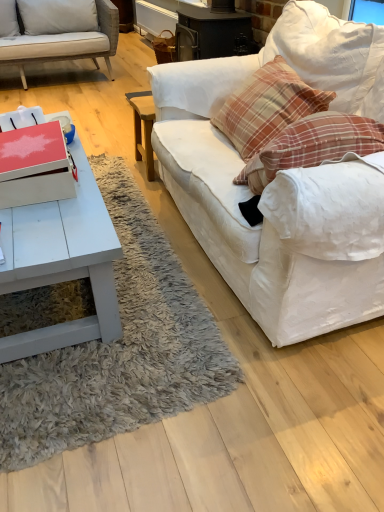
Question: Is white fabric couch at right wider or thinner than white matte coffee table at lower left?

Choices:
 (A) wide
 (B) thin

Answer: (B)

Question: Is white fabric couch at right bigger or smaller than white matte coffee table at lower left?

Choices:
 (A) small
 (B) big

Answer: (B)

Question: Based on their relative distances, which object is nearer to the plaid fabric pillow at upper right?

Choices:
 (A) white fabric couch at right
 (B) white matte coffee table at lower left

Answer: (A)

Question: Estimate the real-world distances between objects in this image. Which object is farther from the white matte coffee table at lower left?

Choices:
 (A) plaid fabric pillow at upper right
 (B) white fabric couch at right

Answer: (A)